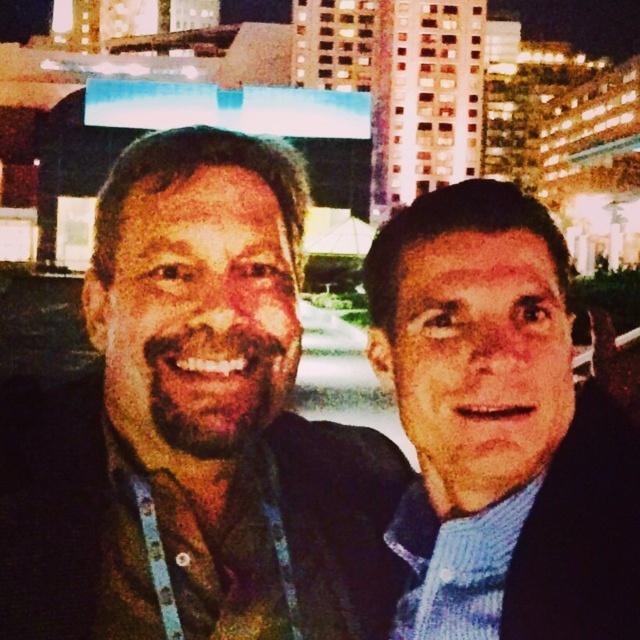
In the scene shown: You are a photographer adjusting your camera settings to capture the blue knit sweater at right in the cityscape photo. The camera has a focus point at coordinates point (499, 428). Is this focus point correctly positioned to capture the blue knit sweater at right?

Yes, the focus point at coordinates point (499, 428) is correctly positioned to capture the blue knit sweater at right because the point marks the location of the blue knit sweater at right.